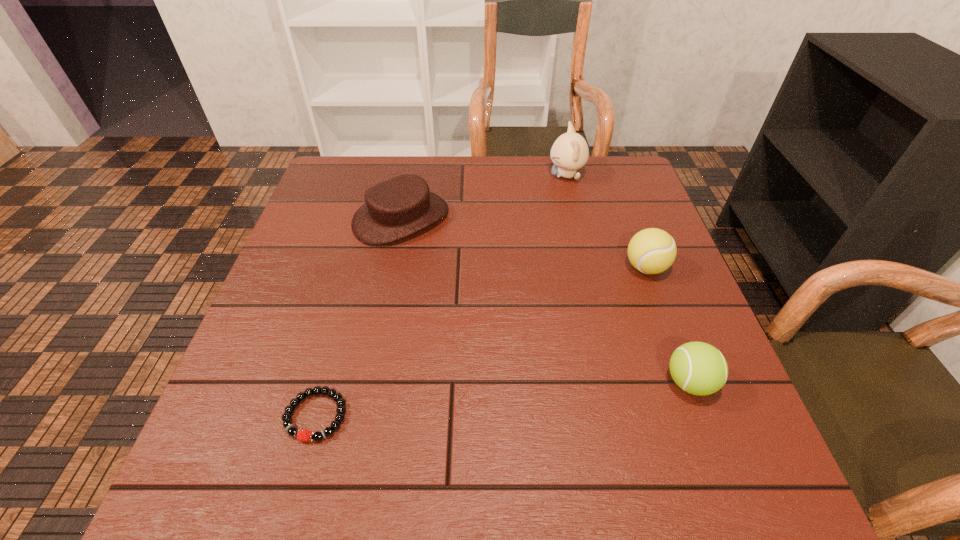
This screenshot has height=540, width=960. Find the location of `vacant space that satisfies the following two spatial constraints: 1. on the back side of the shortest object; 2. on the left side of the hat`. vacant space that satisfies the following two spatial constraints: 1. on the back side of the shortest object; 2. on the left side of the hat is located at coordinates (371, 218).

At what (x,y) coordinates should I click in order to perform the action: click on free space in the image that satisfies the following two spatial constraints: 1. on the face of the kitten; 2. on the front side of the shortest object. Please return your answer as a coordinate pair (x, y). This screenshot has height=540, width=960. Looking at the image, I should click on click(x=624, y=415).

This screenshot has width=960, height=540. I want to click on vacant space that satisfies the following two spatial constraints: 1. on the back side of the nearer tennis ball; 2. on the face of the third object from left to right, so (612, 176).